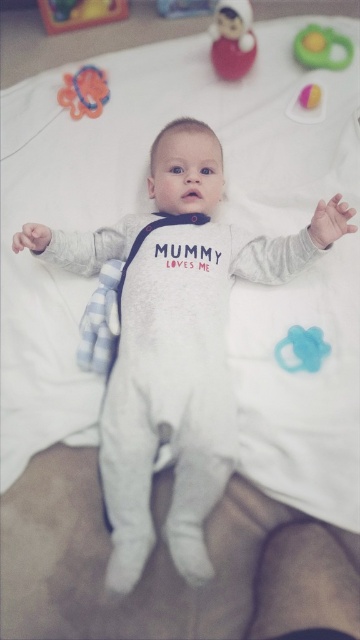
Question: Which object is the closest to the blue rubber pacifier at lower right?

Choices:
 (A) smooth plastic doll at upper center
 (B) rubberized plastic toy at upper right

Answer: (B)

Question: Which point appears farthest from the camera in this image?

Choices:
 (A) (286, 109)
 (B) (206, 272)

Answer: (A)

Question: Is smooth plastic doll at upper center to the left of rubberized orange ring at upper left from the viewer's perspective?

Choices:
 (A) no
 (B) yes

Answer: (A)

Question: Which of the following is the farthest from the observer?

Choices:
 (A) (307, 48)
 (B) (91, 115)
 (C) (317, 109)
 (D) (216, 44)

Answer: (A)

Question: Can you confirm if smooth plastic doll at upper center is positioned above rubberized orange ring at upper left?

Choices:
 (A) no
 (B) yes

Answer: (B)

Question: Can you confirm if white soft onesie at center is positioned to the left of green plastic toy at upper right?

Choices:
 (A) yes
 (B) no

Answer: (A)